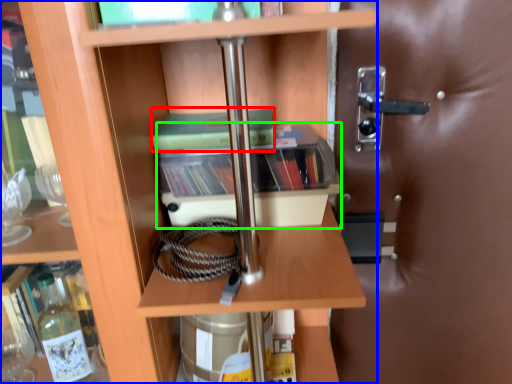
Question: Considering the real-world distances, which object is closest to paperback book (highlighted by a red box)? shelf (highlighted by a blue box) or cabinetry (highlighted by a green box).

Choices:
 (A) shelf
 (B) cabinetry

Answer: (B)